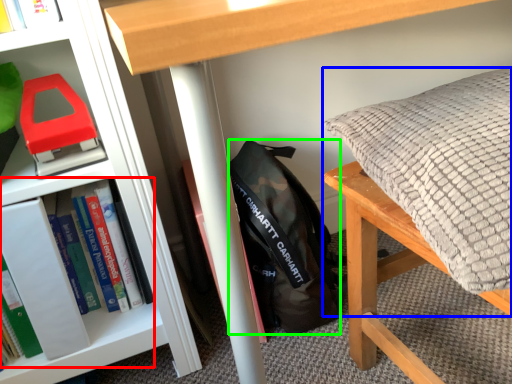
Question: Considering the real-world distances, which object is farthest from book (highlighted by a red box)? pillow (highlighted by a blue box) or backpack (highlighted by a green box)?

Choices:
 (A) pillow
 (B) backpack

Answer: (A)